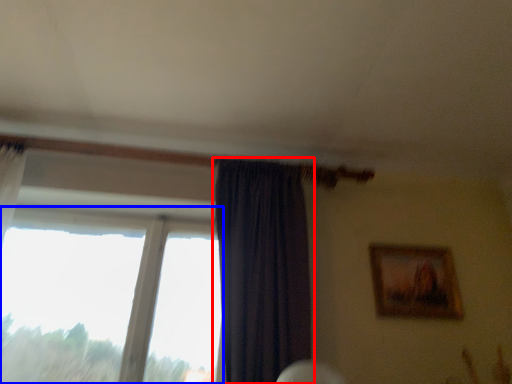
Question: Which point is closer to the camera, curtain (highlighted by a red box) or window (highlighted by a blue box)?

Choices:
 (A) curtain
 (B) window

Answer: (A)